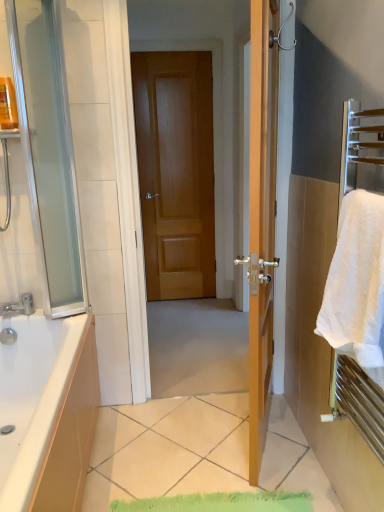
Question: Is white fluffy towel at right looking in the opposite direction of transparent glass screen door at left?

Choices:
 (A) no
 (B) yes

Answer: (A)

Question: Is white fluffy towel at right facing towards transparent glass screen door at left?

Choices:
 (A) no
 (B) yes

Answer: (A)

Question: Does white fluffy towel at right have a lesser height compared to transparent glass screen door at left?

Choices:
 (A) yes
 (B) no

Answer: (A)

Question: Is white fluffy towel at right beside transparent glass screen door at left?

Choices:
 (A) no
 (B) yes

Answer: (A)

Question: Is white fluffy towel at right not inside transparent glass screen door at left?

Choices:
 (A) yes
 (B) no

Answer: (A)

Question: From the image's perspective, is white fluffy towel at right beneath transparent glass screen door at left?

Choices:
 (A) yes
 (B) no

Answer: (A)

Question: Is transparent glass screen door at left facing away from brushed metal faucet at lower left?

Choices:
 (A) no
 (B) yes

Answer: (A)

Question: From a real-world perspective, does transparent glass screen door at left stand above brushed metal faucet at lower left?

Choices:
 (A) no
 (B) yes

Answer: (B)

Question: From the image's perspective, is transparent glass screen door at left on top of brushed metal faucet at lower left?

Choices:
 (A) no
 (B) yes

Answer: (B)

Question: Is transparent glass screen door at left with brushed metal faucet at lower left?

Choices:
 (A) yes
 (B) no

Answer: (B)

Question: From a real-world perspective, is transparent glass screen door at left beneath brushed metal faucet at lower left?

Choices:
 (A) no
 (B) yes

Answer: (A)

Question: Considering the relative sizes of transparent glass screen door at left and brushed metal faucet at lower left in the image provided, is transparent glass screen door at left smaller than brushed metal faucet at lower left?

Choices:
 (A) no
 (B) yes

Answer: (A)

Question: From the image's perspective, is wooden door at center under brushed metal faucet at lower left?

Choices:
 (A) no
 (B) yes

Answer: (A)